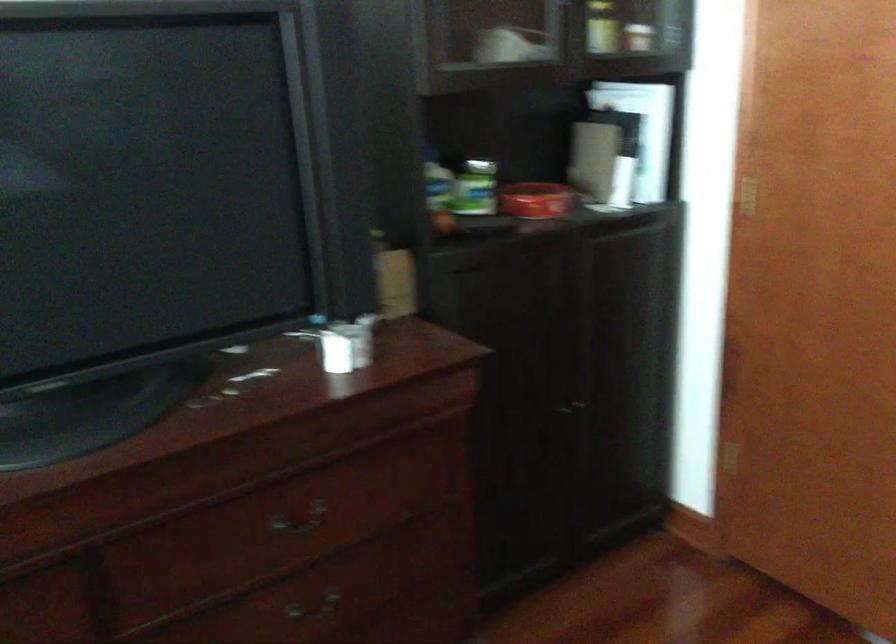
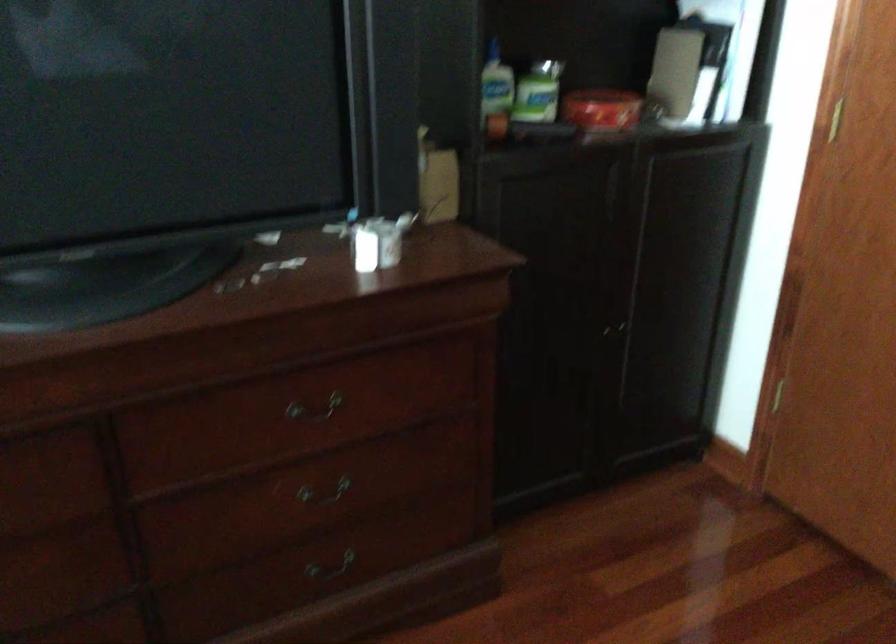
Where in the second image is the point corresponding to the point at 299,518 from the first image?

(314, 409)